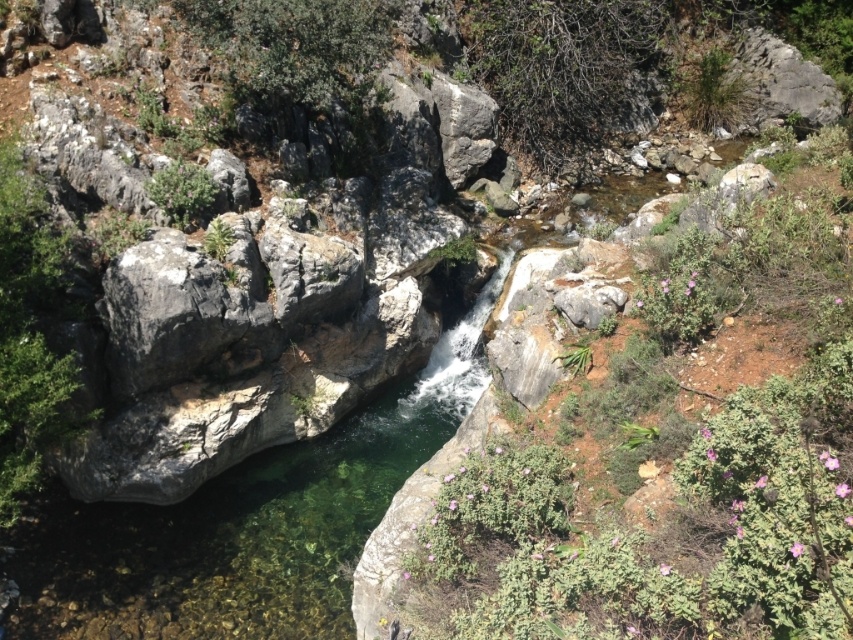
Find the location of a particular element. green leafy bush at upper center is located at coordinates (561, 67).

Between green leafy bush at upper center and green leafy shrub at left, which one appears on the left side from the viewer's perspective?

Positioned to the left is green leafy shrub at left.

Between point (558, 141) and point (24, 296), which one is positioned behind?

The point (558, 141) is behind.

Find the location of a particular element. This screenshot has width=853, height=640. green leafy bush at upper center is located at coordinates (561, 67).

Is green leafy bush at upper center above green leafy bush at upper left?

Yes.

Who is positioned more to the right, green leafy bush at upper center or green leafy bush at upper left?

green leafy bush at upper center

This screenshot has height=640, width=853. Describe the element at coordinates (561, 67) in the screenshot. I see `green leafy bush at upper center` at that location.

The width and height of the screenshot is (853, 640). Find the location of `green leafy bush at upper center`. green leafy bush at upper center is located at coordinates (561, 67).

Which is below, green leafy shrub at left or gray rough rock at center?

green leafy shrub at left

Between green leafy shrub at left and gray rough rock at center, which one has more height?

green leafy shrub at left is taller.

Describe the element at coordinates (32, 332) in the screenshot. Image resolution: width=853 pixels, height=640 pixels. I see `green leafy shrub at left` at that location.

Identify the location of green leafy shrub at left. (32, 332).